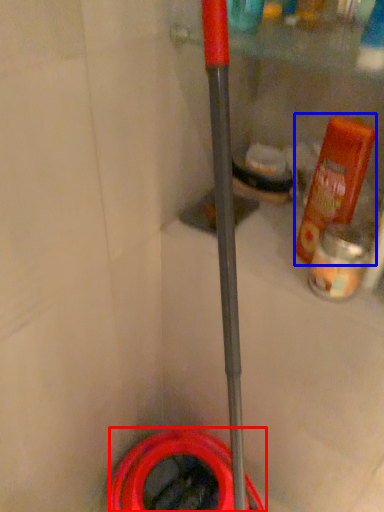
Question: Which of the following is the farthest to the observer, garden hose (highlighted by a red box) or bottle (highlighted by a blue box)?

Choices:
 (A) garden hose
 (B) bottle

Answer: (A)